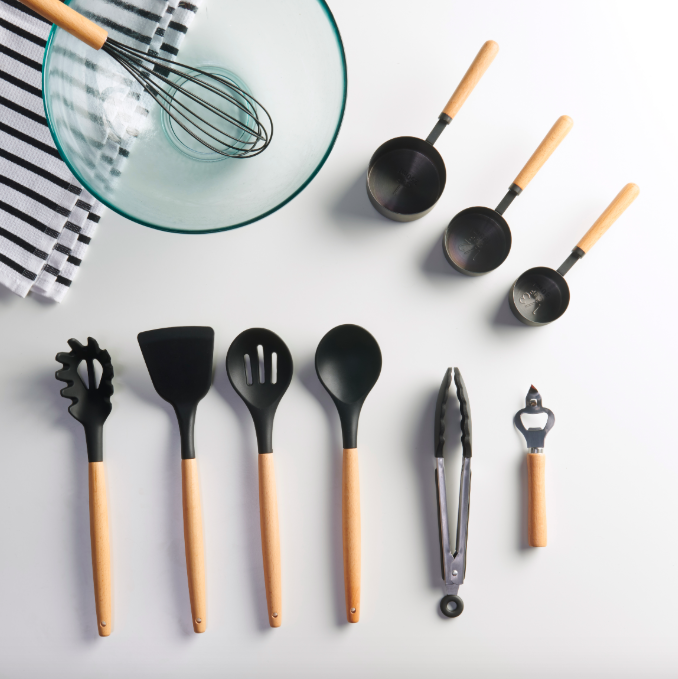
Find the location of `measuring cups`. measuring cups is located at coordinates (549, 267).